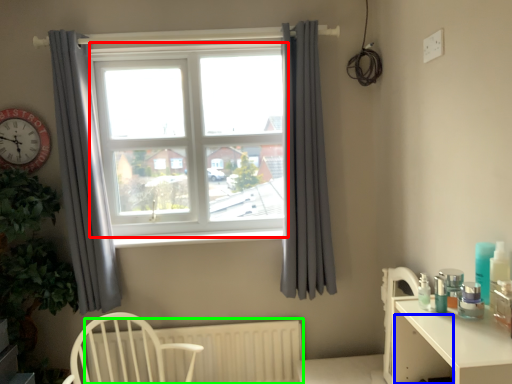
Question: Considering the real-world distances, which object is farthest from window frame (highlighted by a red box)? drawer (highlighted by a blue box) or radiator (highlighted by a green box)?

Choices:
 (A) drawer
 (B) radiator

Answer: (A)